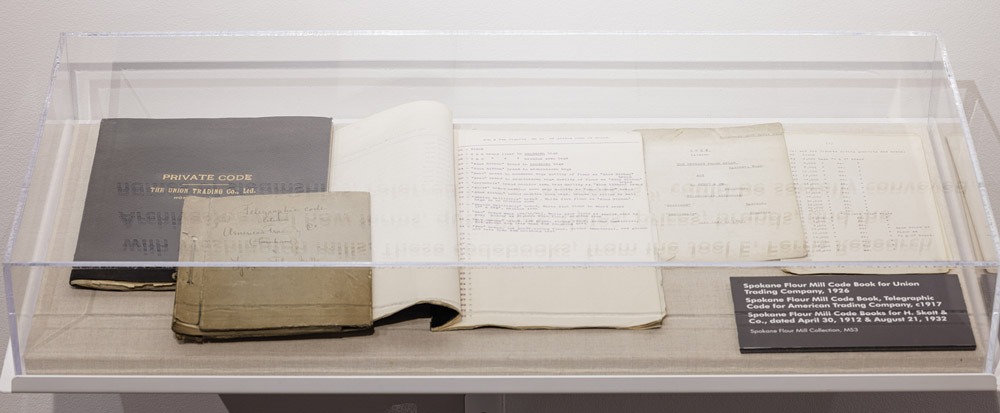
This screenshot has height=413, width=1000. Identify the location of clear plexiglass case. (440, 77).